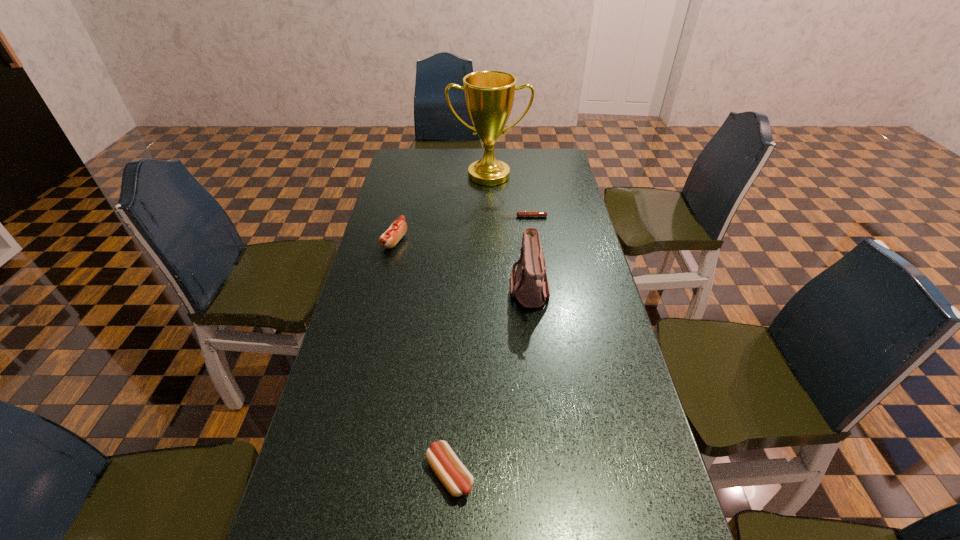
Find the location of a particular element. free space located 0.140m by the handles of the farthest object is located at coordinates (490, 207).

You are a GUI agent. You are given a task and a screenshot of the screen. Output one action in this format:
    pyautogui.click(x=<x>, y=<y>)
    Task: Click on the free space located 0.150m on the front pocket of the fourth farthest object
    Image resolution: width=960 pixels, height=540 pixels.
    Given the screenshot: What is the action you would take?
    pyautogui.click(x=459, y=291)

The image size is (960, 540). Find the location of `vacant space located 0.230m on the front pocket of the fourth farthest object`. vacant space located 0.230m on the front pocket of the fourth farthest object is located at coordinates (432, 291).

I want to click on vacant space situated 0.240m on the front pocket of the fourth farthest object, so click(429, 291).

Where is `vacant space situated on the right of the leftmost object`? vacant space situated on the right of the leftmost object is located at coordinates (460, 241).

This screenshot has width=960, height=540. Find the location of `blank space located 0.240m on the back of the second sausage from right to left`. blank space located 0.240m on the back of the second sausage from right to left is located at coordinates (456, 359).

You are a GUI agent. You are given a task and a screenshot of the screen. Output one action in this format:
    pyautogui.click(x=<x>, y=<y>)
    Task: Click on the blank space located on the back of the rightmost sausage
    
    Given the screenshot: What is the action you would take?
    pyautogui.click(x=522, y=199)

This screenshot has height=540, width=960. Identify the location of object located at the far edge. (489, 95).

Locate an element on the screen. The width and height of the screenshot is (960, 540). object situated at the left edge is located at coordinates (389, 239).

Find the location of a particular element. This screenshot has width=960, height=540. object present at the right edge is located at coordinates (521, 213).